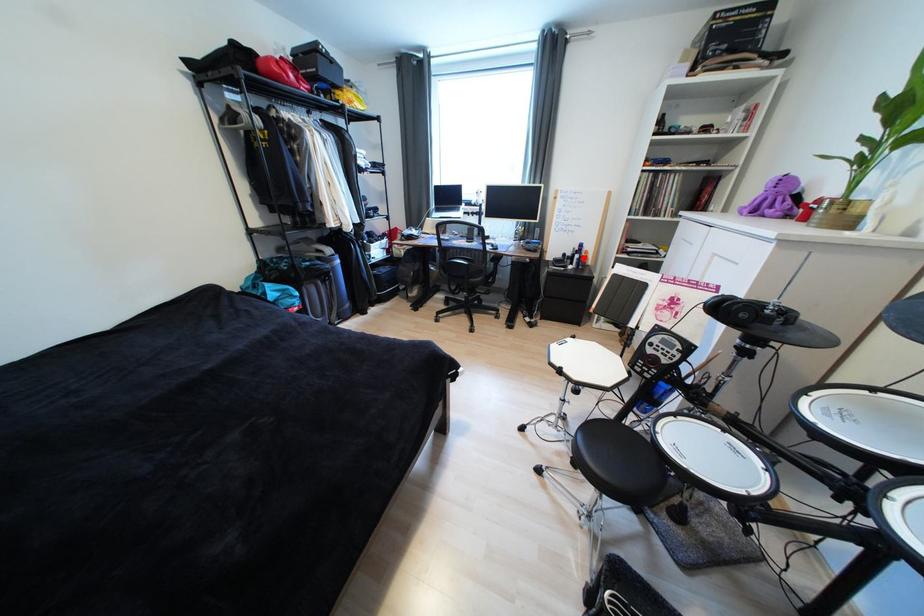
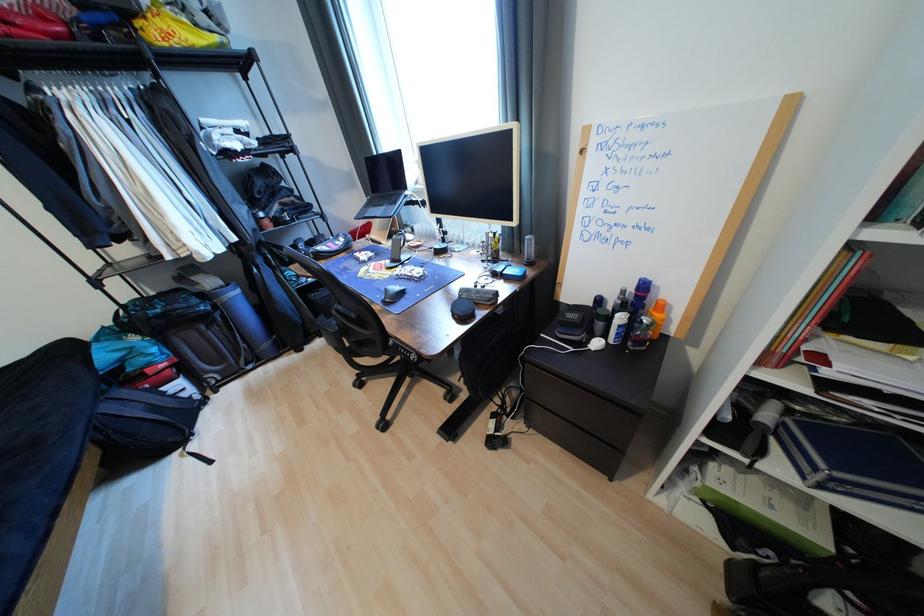
The point at the highlighted location is marked in the first image. Where is the corresponding point in the second image?

(627, 320)